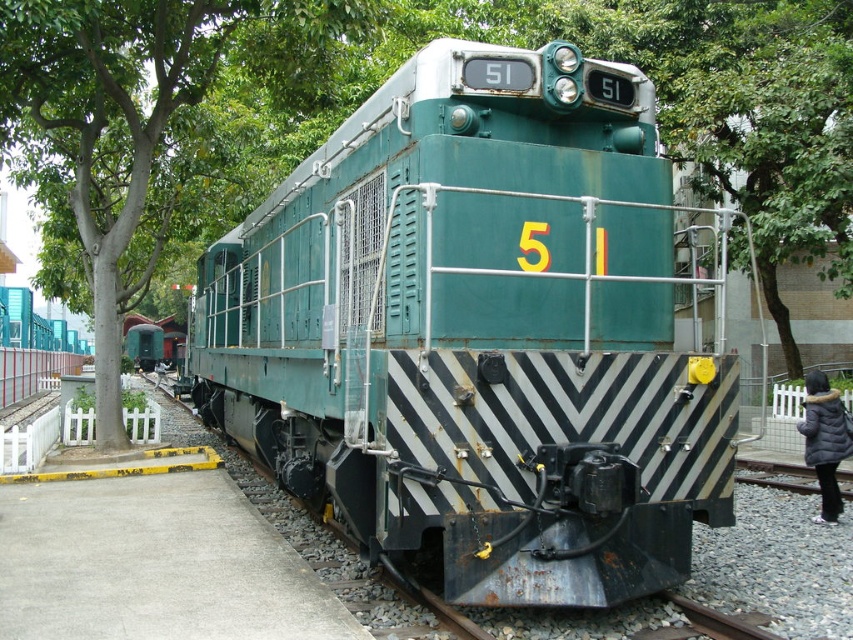
You are an observer standing at the edge of the railway tracks. You see the green matte train at center and the dark gray down jacket at lower right. Which object takes up more area in the image?

The dark gray down jacket at lower right takes up more area in the image than the green matte train at center because the green matte train at center occupies less space than dark gray down jacket at lower right.

You are standing next to the green matte train at center and want to place a dark gray down jacket at lower right. The jacket is 0.5 meters wide. Is there enough space between them to fit the jacket?

The distance between the green matte train at center and the dark gray down jacket at lower right is 6.20 meters. Since the jacket is only 0.5 meters wide, there is sufficient space between them to accommodate the jacket.